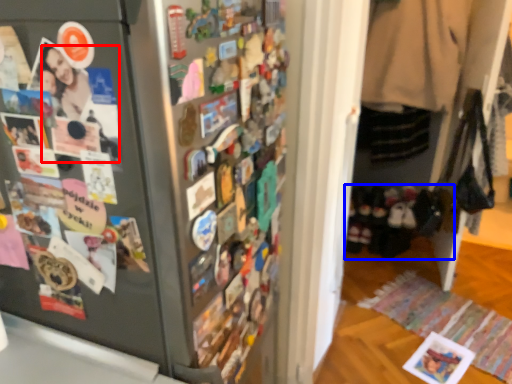
Question: Which point is closer to the camera, person (highlighted by a red box) or footwear (highlighted by a blue box)?

Choices:
 (A) person
 (B) footwear

Answer: (A)